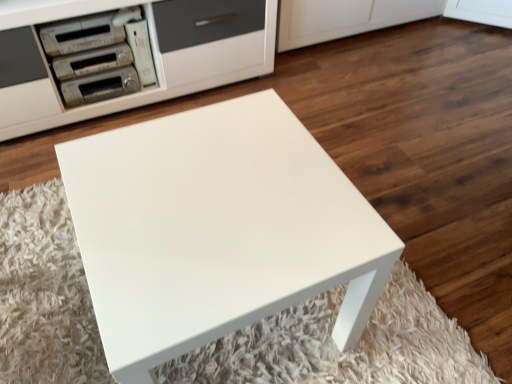
Question: Is metallic silver appliance at upper left, the 1th appliance positioned from the back, turned away from matte silver stereo at upper left, marked as the 2th appliance in a front-to-back arrangement?

Choices:
 (A) no
 (B) yes

Answer: (A)

Question: Is metallic silver appliance at upper left, the 1th appliance positioned from the back, facing towards matte silver stereo at upper left, marked as the 2th appliance in a front-to-back arrangement?

Choices:
 (A) yes
 (B) no

Answer: (B)

Question: From the image's perspective, is metallic silver appliance at upper left, the 1th appliance positioned from the back, on top of matte silver stereo at upper left, acting as the third appliance starting from the back?

Choices:
 (A) no
 (B) yes

Answer: (A)

Question: Considering the relative sizes of metallic silver appliance at upper left, the 1th appliance positioned from the back, and matte silver stereo at upper left, acting as the third appliance starting from the back, in the image provided, is metallic silver appliance at upper left, the 1th appliance positioned from the back, wider than matte silver stereo at upper left, acting as the third appliance starting from the back,?

Choices:
 (A) no
 (B) yes

Answer: (B)

Question: Is metallic silver appliance at upper left, which is the fourth appliance in front-to-back order, shorter than matte silver stereo at upper left, acting as the third appliance starting from the back?

Choices:
 (A) no
 (B) yes

Answer: (A)

Question: Considering the relative positions of metallic silver appliance at upper left, which is the fourth appliance in front-to-back order, and matte silver stereo at upper left, marked as the 2th appliance in a front-to-back arrangement, in the image provided, is metallic silver appliance at upper left, which is the fourth appliance in front-to-back order, to the right of matte silver stereo at upper left, marked as the 2th appliance in a front-to-back arrangement, from the viewer's perspective?

Choices:
 (A) no
 (B) yes

Answer: (B)

Question: Is white plastic game console at upper left, which is the 2th appliance from back to front, further to camera compared to metallic silver stereo at upper left, which appears as the first appliance when viewed from the front?

Choices:
 (A) no
 (B) yes

Answer: (B)

Question: Considering the relative sizes of white plastic game console at upper left, which is the 2th appliance from back to front, and metallic silver stereo at upper left, the fourth appliance viewed from the back, in the image provided, is white plastic game console at upper left, which is the 2th appliance from back to front, taller than metallic silver stereo at upper left, the fourth appliance viewed from the back,?

Choices:
 (A) yes
 (B) no

Answer: (A)

Question: Does white plastic game console at upper left, the third appliance positioned from the front, contain metallic silver stereo at upper left, the fourth appliance viewed from the back?

Choices:
 (A) yes
 (B) no

Answer: (B)

Question: Is white plastic game console at upper left, which is the 2th appliance from back to front, positioned with its back to metallic silver stereo at upper left, the fourth appliance viewed from the back?

Choices:
 (A) no
 (B) yes

Answer: (A)

Question: Is white plastic game console at upper left, the third appliance positioned from the front, aimed at metallic silver stereo at upper left, the fourth appliance viewed from the back?

Choices:
 (A) yes
 (B) no

Answer: (B)

Question: Considering the relative sizes of white plastic game console at upper left, the third appliance positioned from the front, and metallic silver stereo at upper left, which appears as the first appliance when viewed from the front, in the image provided, is white plastic game console at upper left, the third appliance positioned from the front, thinner than metallic silver stereo at upper left, which appears as the first appliance when viewed from the front,?

Choices:
 (A) no
 (B) yes

Answer: (A)

Question: From the image's perspective, is metallic silver appliance at upper left, the 1th appliance positioned from the back, under metallic silver stereo at upper left, which appears as the first appliance when viewed from the front?

Choices:
 (A) yes
 (B) no

Answer: (A)